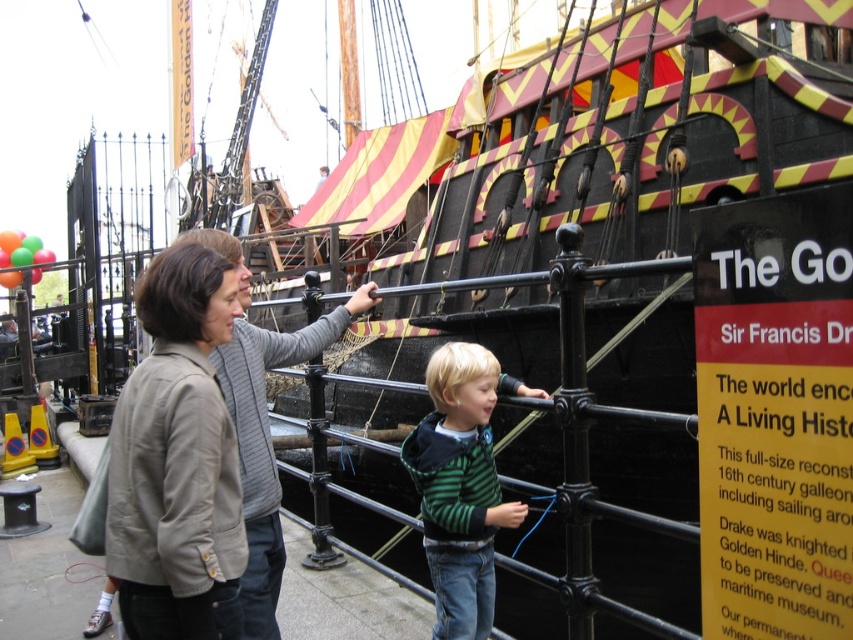
You are an event organizer planning to seat two attendees wearing a light brown fabric jacket at center and a green striped sweater at center in a row of chairs. If the chairs are spaced 2 feet apart, will the jackets of both attendees fit comfortably without overlapping?

The light brown fabric jacket at center has a larger width than the green striped sweater at center. Since the chairs are spaced 2 feet apart, the jackets may overlap if the jackets are wider than the spacing. However, without specific measurements, it is uncertain. The description only states the jacket is wider than the sweater, but not the exact dimensions.